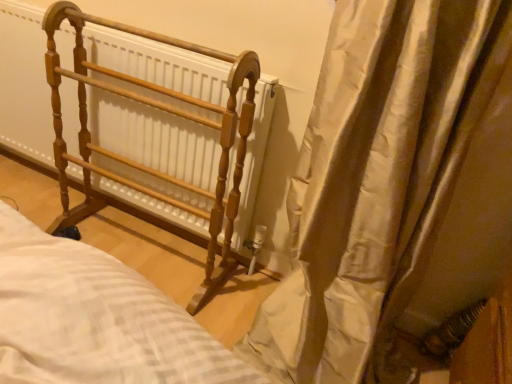
Question: Considering the positions of point (204, 100) and point (370, 62), is point (204, 100) closer or farther from the camera than point (370, 62)?

Choices:
 (A) closer
 (B) farther

Answer: (B)

Question: Is wooden rack at left wider or thinner than silky beige curtain at right?

Choices:
 (A) wide
 (B) thin

Answer: (B)

Question: From a real-world perspective, relative to silky beige curtain at right, is wooden rack at left vertically above or below?

Choices:
 (A) below
 (B) above

Answer: (A)

Question: Does point (328, 165) appear closer or farther from the camera than point (212, 240)?

Choices:
 (A) closer
 (B) farther

Answer: (A)

Question: Would you say silky beige curtain at right is inside or outside wooden rack at left?

Choices:
 (A) outside
 (B) inside

Answer: (A)

Question: Is silky beige curtain at right in front of or behind wooden rack at left in the image?

Choices:
 (A) front
 (B) behind

Answer: (A)

Question: In the image, is silky beige curtain at right on the left side or the right side of wooden rack at left?

Choices:
 (A) left
 (B) right

Answer: (B)